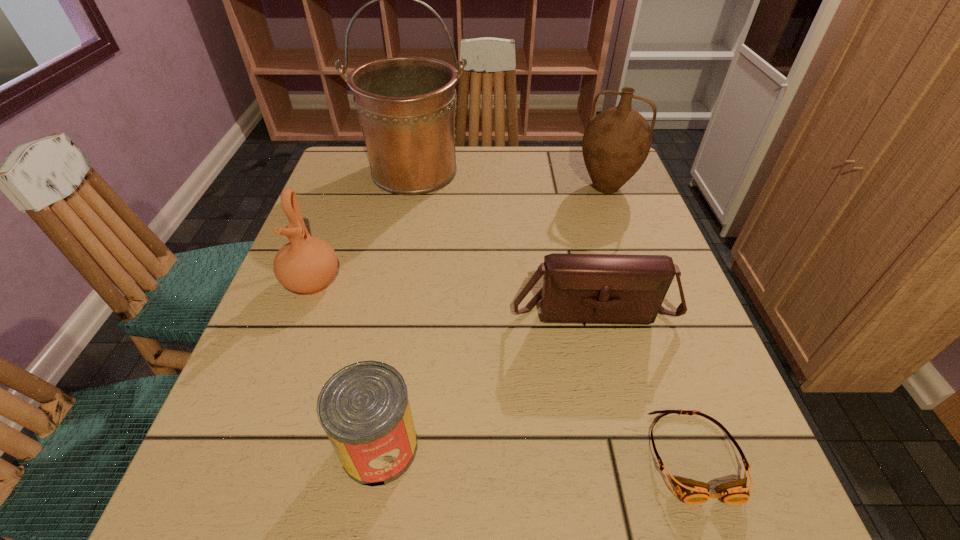
At what (x,y) coordinates should I click in order to perform the action: click on the tallest object. Please return your answer as a coordinate pair (x, y). The width and height of the screenshot is (960, 540). Looking at the image, I should click on (406, 106).

This screenshot has width=960, height=540. I want to click on the fifth shortest object, so click(616, 142).

Image resolution: width=960 pixels, height=540 pixels. Identify the location of pottery. (306, 265).

Locate an element on the screen. Image resolution: width=960 pixels, height=540 pixels. shoulder bag is located at coordinates (577, 288).

Find the location of a particular element. The width and height of the screenshot is (960, 540). can is located at coordinates (364, 409).

At what (x,y) coordinates should I click in order to perform the action: click on goggles. Please return your answer as a coordinate pair (x, y). Looking at the image, I should click on (692, 492).

Find the location of `free location located 0.240m on the front of the bucket`. free location located 0.240m on the front of the bucket is located at coordinates (396, 267).

Where is `vacant space situated on the front of the pitcher`? vacant space situated on the front of the pitcher is located at coordinates (639, 280).

Locate an element on the screen. The width and height of the screenshot is (960, 540). vacant area located on the spout of the third tallest object is located at coordinates (228, 508).

You are a GUI agent. You are given a task and a screenshot of the screen. Output one action in this format:
    pyautogui.click(x=<x>, y=<y>)
    Task: Click on the free space located on the front flap of the shoulder bag
    The width and height of the screenshot is (960, 540).
    Given the screenshot: What is the action you would take?
    pyautogui.click(x=640, y=504)